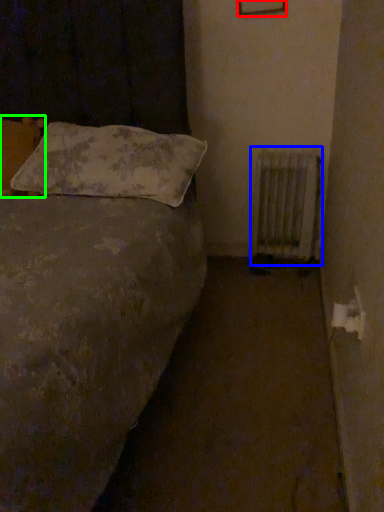
Question: Considering the real-world distances, which object is closest to picture frame (highlighted by a red box)? radiator (highlighted by a blue box) or pillow (highlighted by a green box).

Choices:
 (A) radiator
 (B) pillow

Answer: (A)